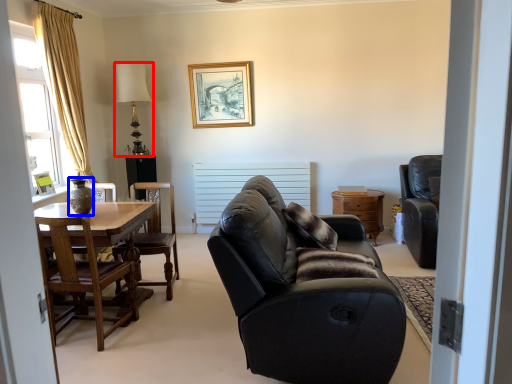
Question: Which object is further to the camera taking this photo, lamp (highlighted by a red box) or vase (highlighted by a blue box)?

Choices:
 (A) lamp
 (B) vase

Answer: (A)